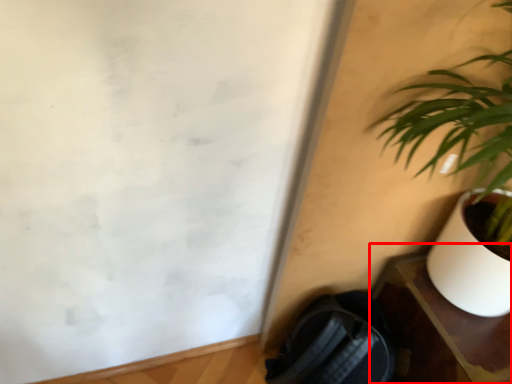
Question: From the image's perspective, what is the correct spatial relationship of table (annotated by the red box) in relation to houseplant?

Choices:
 (A) below
 (B) above

Answer: (A)